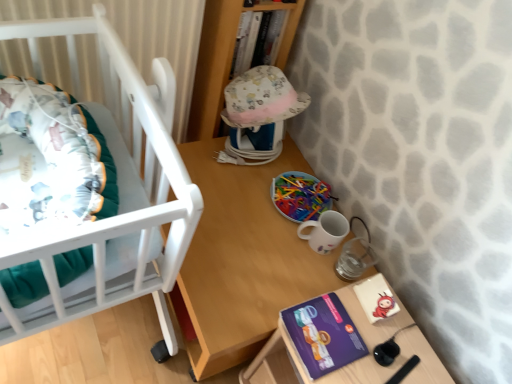
At what (x,y) coordinates should I click in order to perform the action: click on free point behind multicolored plastic sticks at center. Please return your answer as a coordinate pair (x, y). Looking at the image, I should click on (295, 157).